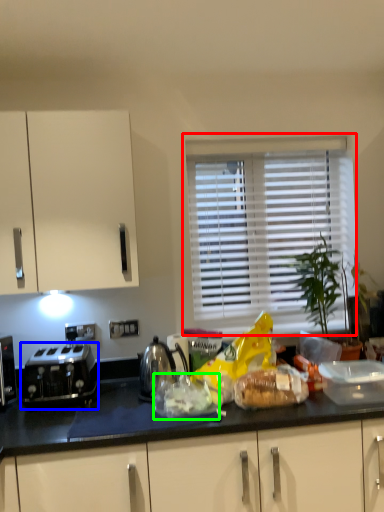
Question: Which object is the closest to the window (highlighted by a red box)? Choose among these: toaster (highlighted by a blue box) or food (highlighted by a green box).

Choices:
 (A) toaster
 (B) food

Answer: (B)